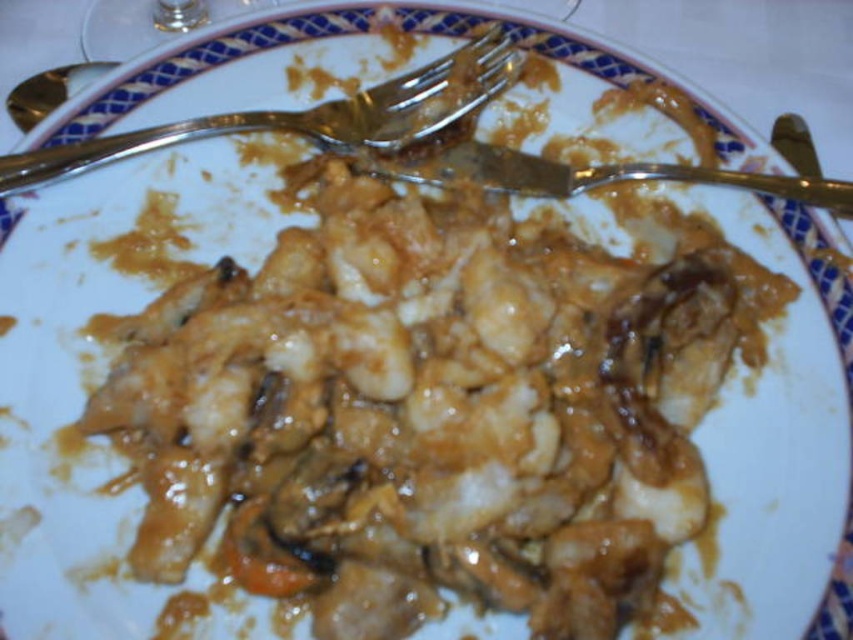
Between gold metallic fork at upper left and gold metallic spoon at upper left, which one has more height?

With more height is gold metallic fork at upper left.

Is gold metallic fork at upper left positioned in front of gold metallic spoon at upper left?

Yes.

Is point (351, 115) positioned after point (79, 67)?

No, it is in front of (79, 67).

Identify the location of gold metallic fork at upper left. (306, 116).

I want to click on gold metallic fork at upper left, so click(306, 116).

Locate an element on the screen. The height and width of the screenshot is (640, 853). gold metallic fork at upper left is located at coordinates (306, 116).

Consider the image. Can you confirm if satin silver knife at center is bigger than gold metallic spoon at upper left?

Indeed, satin silver knife at center has a larger size compared to gold metallic spoon at upper left.

Who is more distant from viewer, [833,186] or [39,74]?

Point [39,74]

The height and width of the screenshot is (640, 853). Identify the location of satin silver knife at center. (578, 173).